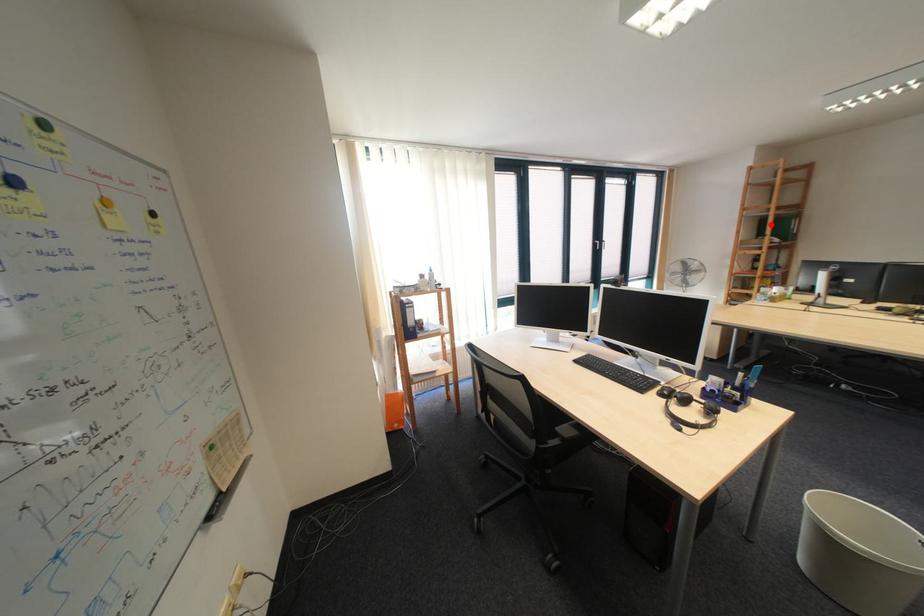
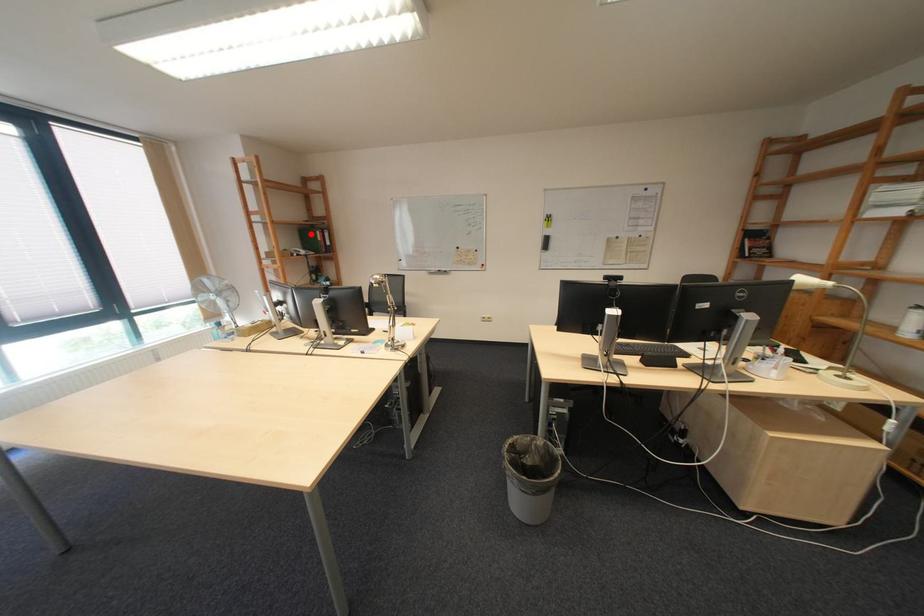
I am providing you with two images of the same scene from different viewpoints. A red point is marked on the first image and another point is marked on the second image. Is the marked point in image1 the same physical position as the marked point in image2?

Yes